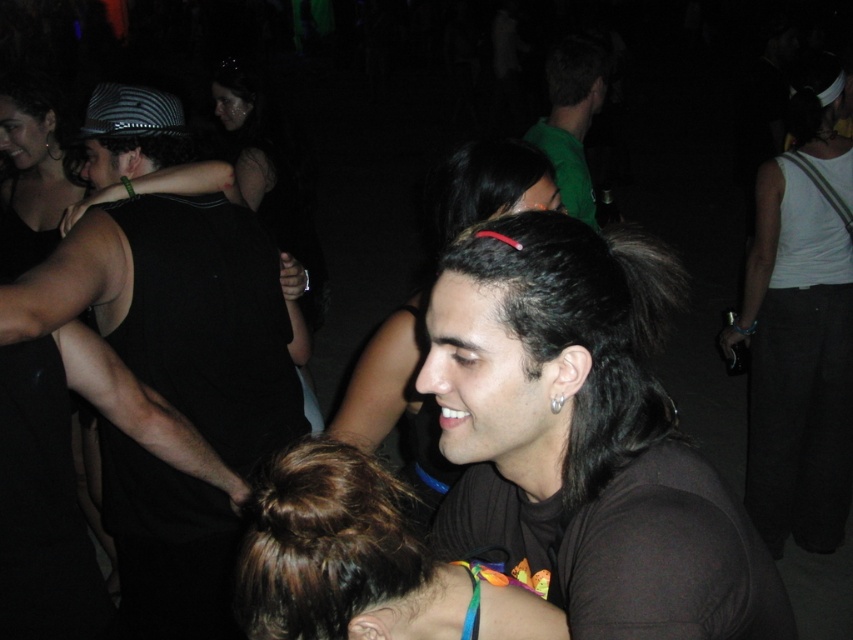
You are at a party and see the dark brown hair at center and the green matte shirt at upper center. Which one is closer to the bottom of the image?

The dark brown hair at center is closer to the bottom of the image because it is below the green matte shirt at upper center.

You are at a party and see the dark brown hair at center and the green matte shirt at upper center. Which one is closer to you?

The dark brown hair at center is closer to you because it is in front of the green matte shirt at upper center.

Looking at this image, you are at a party and see the black shiny hair at center and the green matte shirt at upper center. Which one is positioned lower in the image?

The black shiny hair at center is located below the green matte shirt at upper center, so the black shiny hair at center is positioned lower in the image.